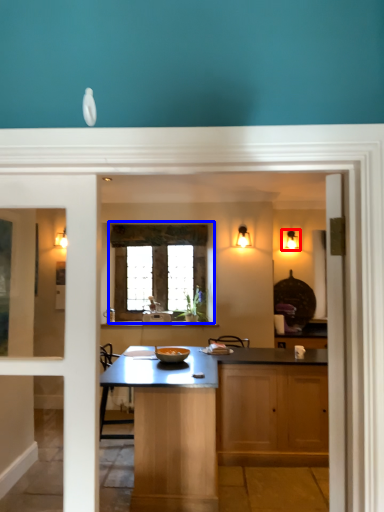
Question: Which object appears closest to the camera in this image, light fixture (highlighted by a red box) or window (highlighted by a blue box)?

Choices:
 (A) light fixture
 (B) window

Answer: (B)